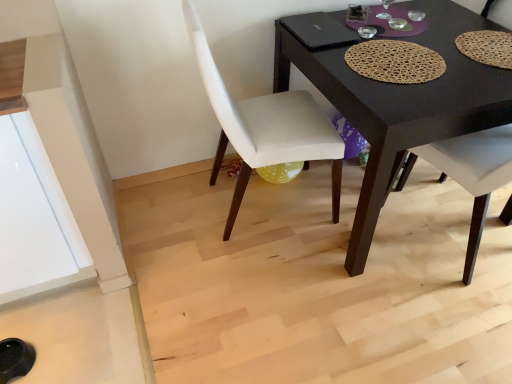
Where is `vacant space underneath white fabric chair at center, the second chair viewed from the right (from a real-world perspective)`? vacant space underneath white fabric chair at center, the second chair viewed from the right (from a real-world perspective) is located at coordinates (258, 206).